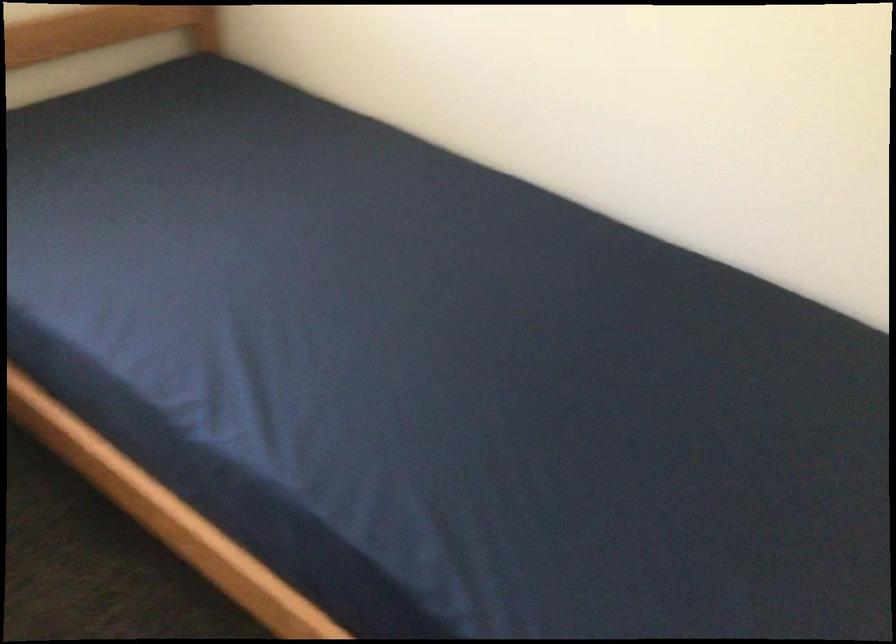
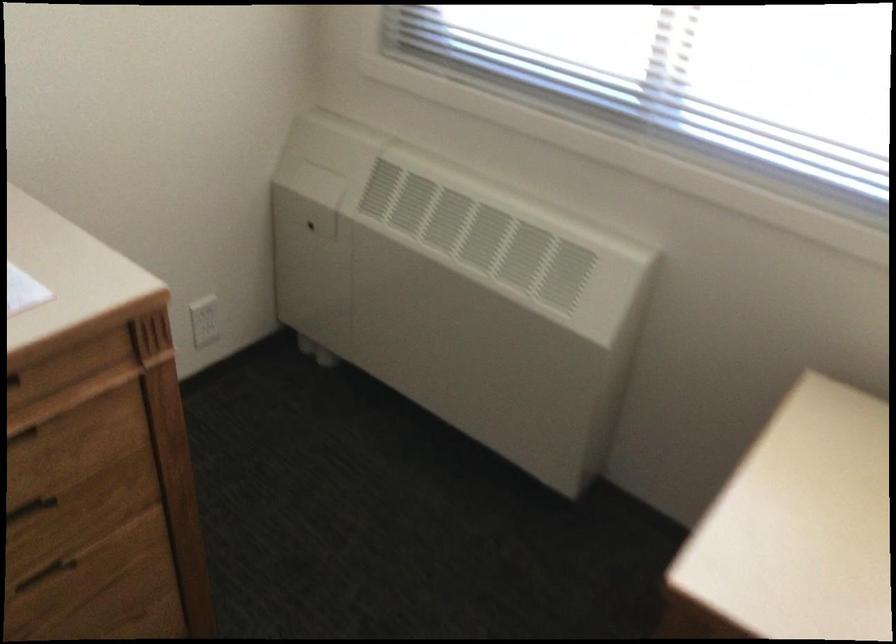
The images are taken continuously from a first-person perspective. In which direction is your viewpoint rotating?

The camera rotated toward left-down.